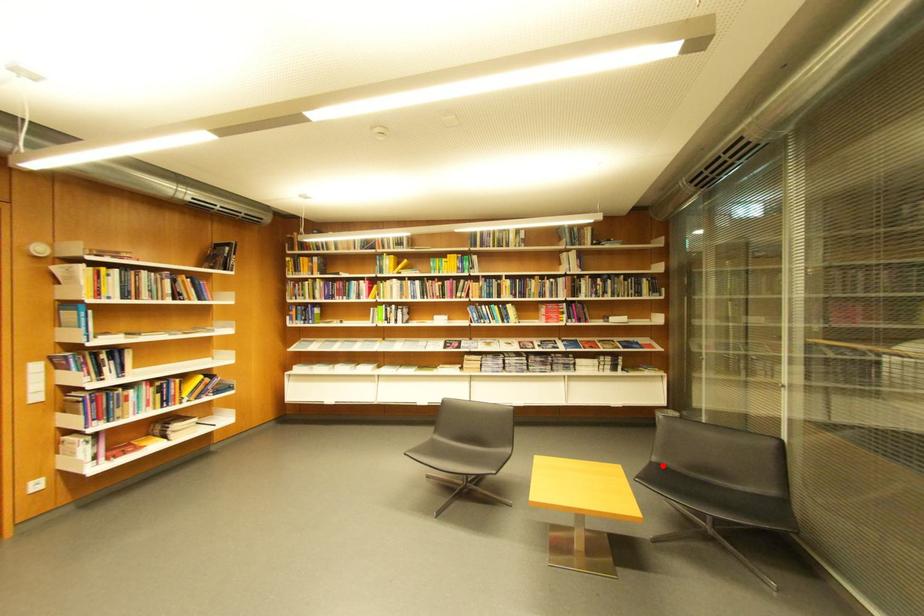
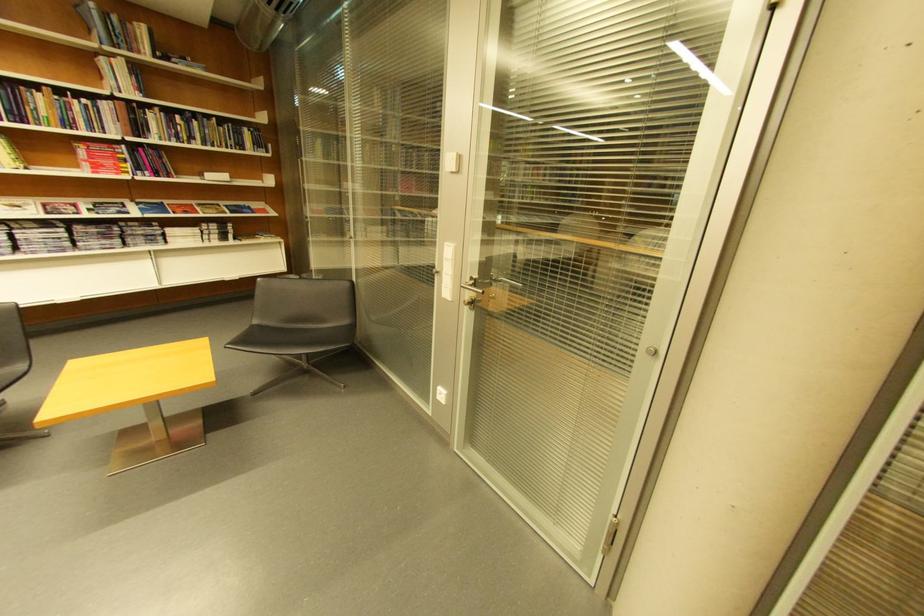
The point at the highlighted location is marked in the first image. Where is the corresponding point in the second image?

(262, 329)